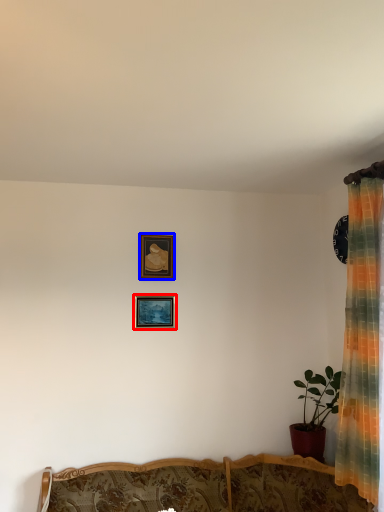
Question: Which object is further to the camera taking this photo, picture frame (highlighted by a red box) or picture frame (highlighted by a blue box)?

Choices:
 (A) picture frame
 (B) picture frame

Answer: (B)